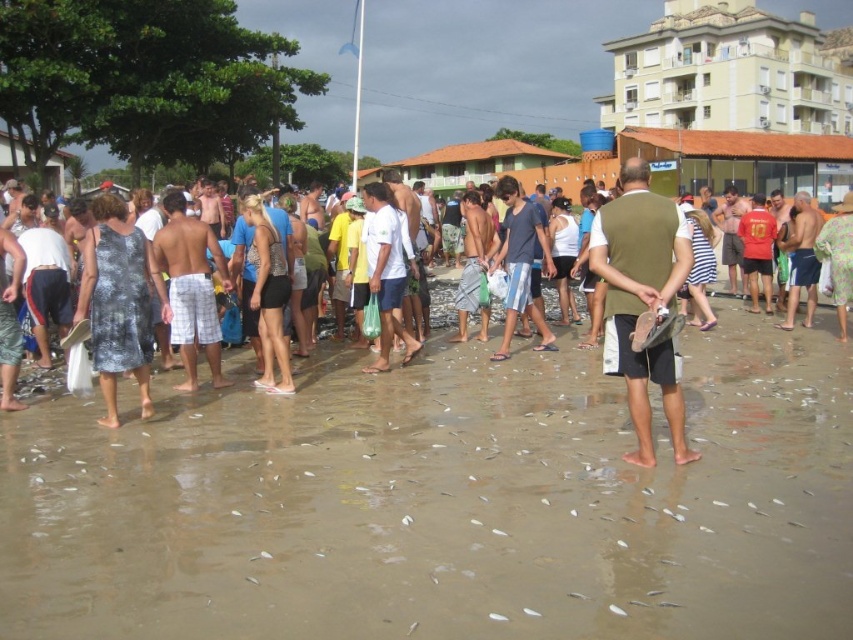
Question: Is green fabric vest at center above white matte shorts at center?

Choices:
 (A) no
 (B) yes

Answer: (A)

Question: Does printed fabric dress at left have a larger size compared to white plaid shorts at center?

Choices:
 (A) no
 (B) yes

Answer: (B)

Question: Where is matte black dress at center located in relation to printed fabric dress at left in the image?

Choices:
 (A) below
 (B) above

Answer: (B)

Question: Among these objects, which one is farthest from the camera?

Choices:
 (A) matte black dress at center
 (B) green fabric vest at center
 (C) white plaid shorts at center

Answer: (C)

Question: Which point is farther to the camera?

Choices:
 (A) (126, 244)
 (B) (131, 218)

Answer: (B)

Question: Estimate the real-world distances between objects in this image. Which object is closer to the printed fabric dress at left?

Choices:
 (A) matte black dress at center
 (B) brown sand at center

Answer: (A)